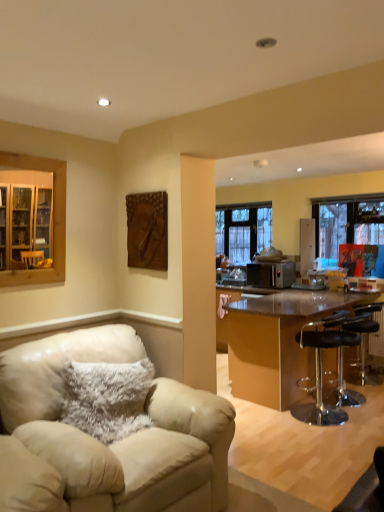
Question: Should I look upward or downward to see fuzzy beige pillow at lower left?

Choices:
 (A) down
 (B) up

Answer: (A)

Question: Is transparent plastic bar stool at right, which ranks as the 3th chair in front-to-back order, touching wooden cabinet at left?

Choices:
 (A) no
 (B) yes

Answer: (A)

Question: Is the position of transparent plastic bar stool at right, marked as the 3th chair in a left-to-right arrangement, less distant than that of wooden cabinet at left?

Choices:
 (A) no
 (B) yes

Answer: (A)

Question: Is transparent plastic bar stool at right, the second chair from the back, not close to wooden cabinet at left?

Choices:
 (A) yes
 (B) no

Answer: (A)

Question: From a real-world perspective, is transparent plastic bar stool at right, the second chair from the back, located higher than wooden cabinet at left?

Choices:
 (A) yes
 (B) no

Answer: (B)

Question: Is wooden cabinet at left surrounded by transparent plastic bar stool at right, the second chair from the back?

Choices:
 (A) yes
 (B) no

Answer: (B)

Question: Is transparent plastic bar stool at right, which appears as the 2th chair when viewed from the right, facing away from wooden cabinet at left?

Choices:
 (A) no
 (B) yes

Answer: (A)

Question: Can you confirm if shiny brown table at right is shorter than transparent plastic bar stool at right, which appears as the 2th chair when viewed from the right?

Choices:
 (A) no
 (B) yes

Answer: (A)

Question: Is shiny brown table at right aimed at transparent plastic bar stool at right, the second chair from the back?

Choices:
 (A) yes
 (B) no

Answer: (A)

Question: From a real-world perspective, is shiny brown table at right on top of transparent plastic bar stool at right, the second chair from the back?

Choices:
 (A) no
 (B) yes

Answer: (B)

Question: From the image's perspective, is shiny brown table at right on transparent plastic bar stool at right, the second chair from the back?

Choices:
 (A) yes
 (B) no

Answer: (A)

Question: Is shiny brown table at right not within transparent plastic bar stool at right, the second chair from the back?

Choices:
 (A) no
 (B) yes

Answer: (B)

Question: Does shiny brown table at right appear on the right side of transparent plastic bar stool at right, which appears as the 2th chair when viewed from the right?

Choices:
 (A) yes
 (B) no

Answer: (B)

Question: From a real-world perspective, is black leather bar stool at right, the second chair in the left-to-right sequence, under transparent plastic bar stool at right, which appears as the 2th chair when viewed from the right?

Choices:
 (A) no
 (B) yes

Answer: (A)